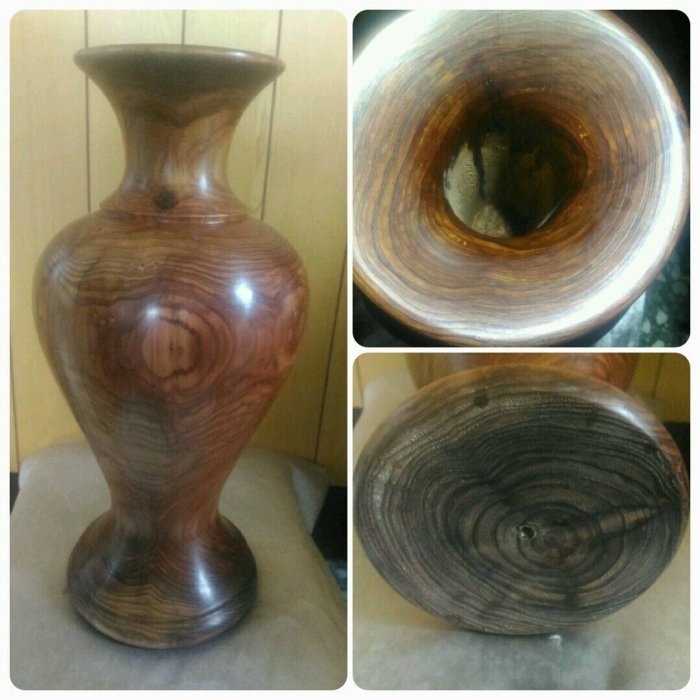
You are a GUI agent. You are given a task and a screenshot of the screen. Output one action in this format:
    pyautogui.click(x=<x>, y=<y>)
    Task: Click on the bottom of pot
    The width and height of the screenshot is (700, 700).
    Given the screenshot: What is the action you would take?
    pyautogui.click(x=522, y=502)